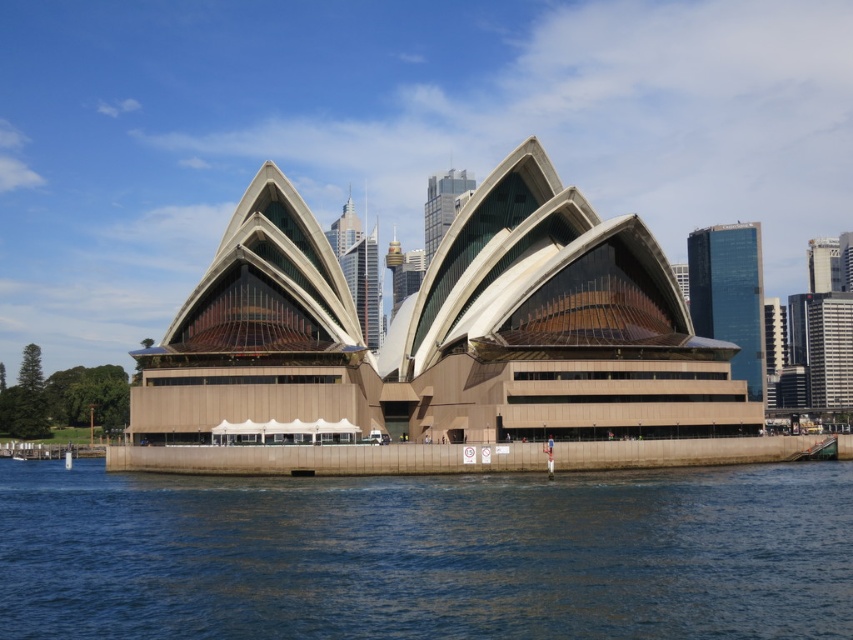
Who is positioned more to the left, blue water at lower center or beige concrete opera house at center?

beige concrete opera house at center

Does point (326, 600) come farther from viewer compared to point (596, 227)?

That is False.

The width and height of the screenshot is (853, 640). Identify the location of blue water at lower center. (426, 554).